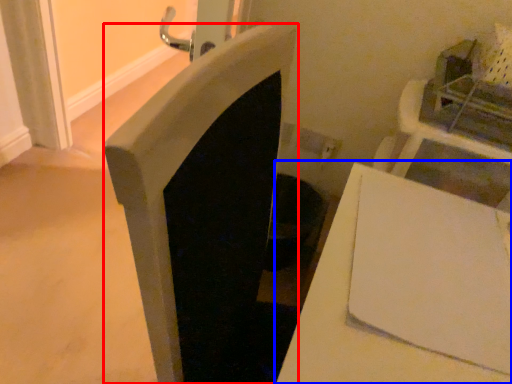
Question: Which of the following is the farthest to the observer, fireplace (highlighted by a red box) or table (highlighted by a blue box)?

Choices:
 (A) fireplace
 (B) table

Answer: (A)